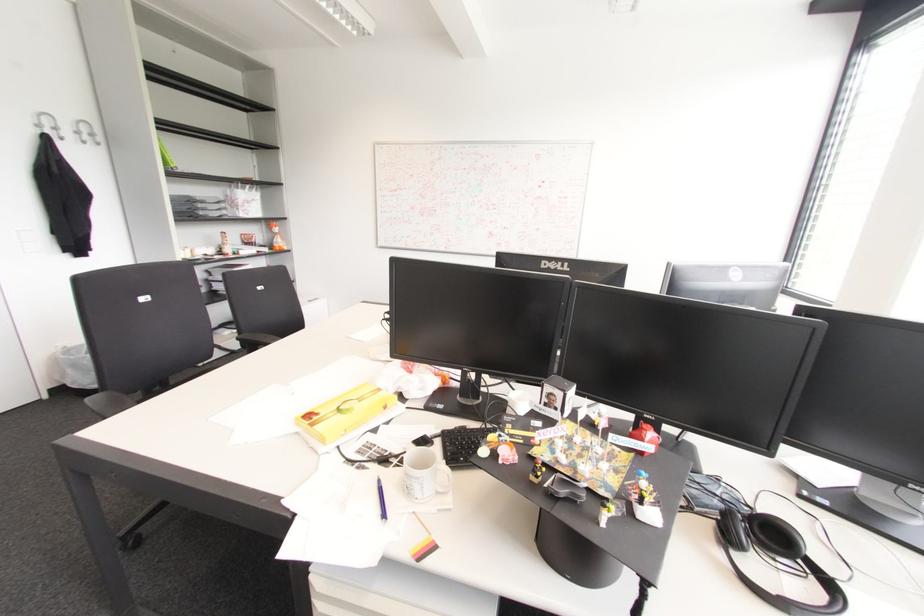
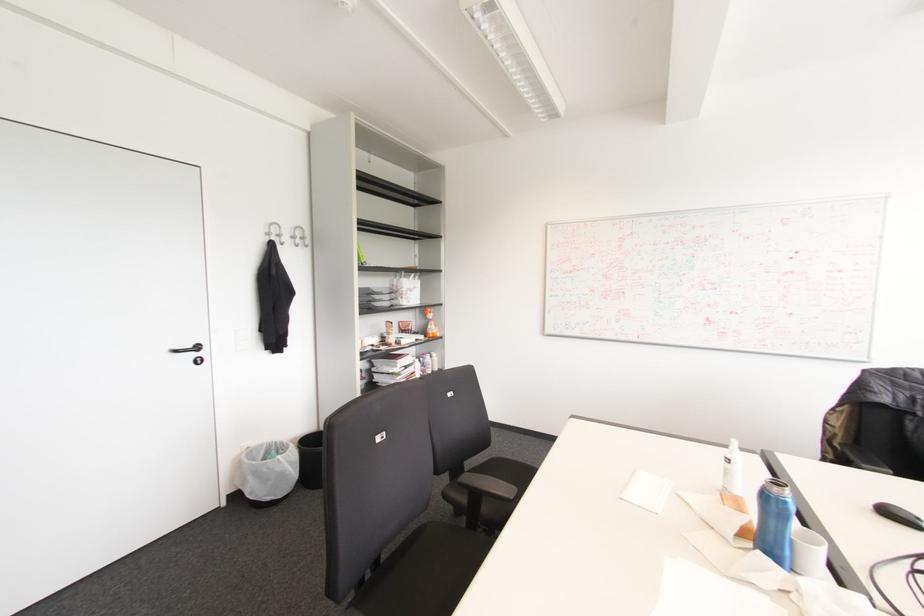
Which direction would the cameraman need to move to produce the second image?

The movement direction of the cameraman is left, forward.